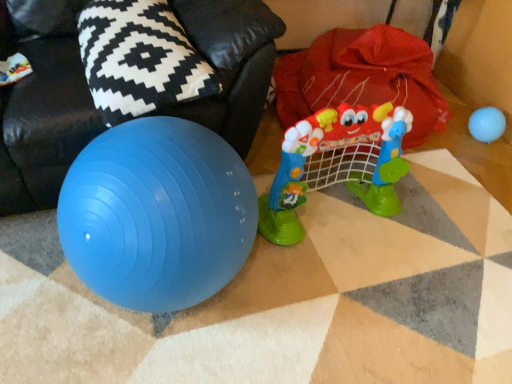
Find the location of a particular element. Image resolution: width=512 pixels, height=384 pixels. free space in front of plastic toy at center, the 2th toy viewed from the right is located at coordinates (350, 296).